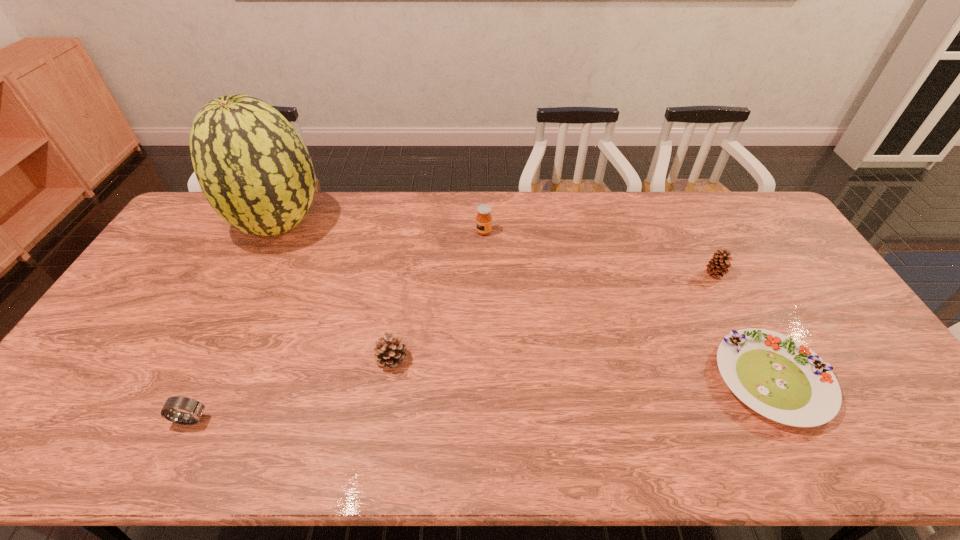
This screenshot has width=960, height=540. Identify the location of object positioned at the right edge. (778, 377).

At what (x,y) coordinates should I click in order to perform the action: click on object that is at the near right corner. Please return your answer as a coordinate pair (x, y). The image size is (960, 540). Looking at the image, I should click on (778, 377).

At what (x,y) coordinates should I click in order to perform the action: click on free space at the far edge. Please return your answer as a coordinate pair (x, y). The image size is (960, 540). Looking at the image, I should click on (673, 195).

In the image, there is a desktop. Identify the location of free space at the near edge. pyautogui.click(x=450, y=451).

Where is `vacant position at the left edge of the desktop`? Image resolution: width=960 pixels, height=540 pixels. vacant position at the left edge of the desktop is located at coordinates (153, 343).

Image resolution: width=960 pixels, height=540 pixels. What are the coordinates of `free region at the right edge of the desktop` in the screenshot? It's located at (765, 234).

You are a GUI agent. You are given a task and a screenshot of the screen. Output one action in this format:
    pyautogui.click(x=<x>, y=<y>)
    Task: Click on the vacant space at the far right corner of the desktop
    The height and width of the screenshot is (540, 960).
    Given the screenshot: What is the action you would take?
    pyautogui.click(x=726, y=210)

Where is `unoccupied area between the farther pinecone and the fifth tallest object`? The width and height of the screenshot is (960, 540). unoccupied area between the farther pinecone and the fifth tallest object is located at coordinates pos(453,347).

The image size is (960, 540). Find the location of `blank region between the nearer pinecone and the salad plate`. blank region between the nearer pinecone and the salad plate is located at coordinates (583, 369).

Locate an element on the screen. This screenshot has width=960, height=540. free space between the honey and the salad plate is located at coordinates (628, 306).